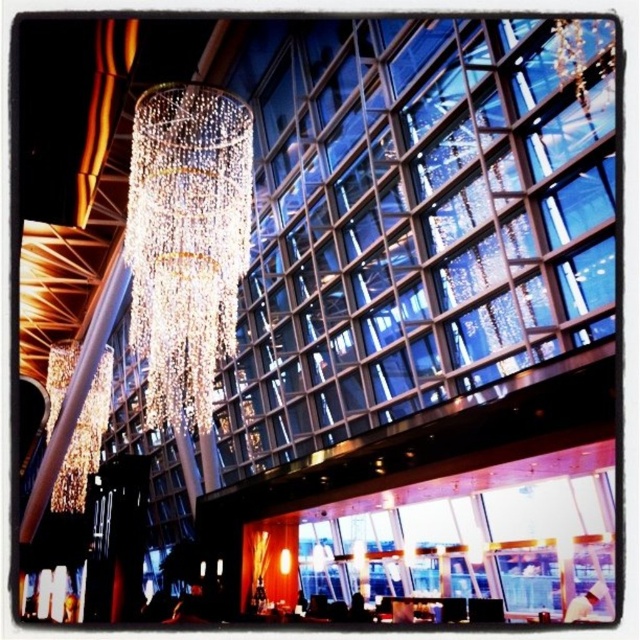
You are a guest standing in the lobby and want to locate the clear crystal chandelier at center. Which direction should you look relative to the iridescent glass chandelier at upper center?

The clear crystal chandelier at center is positioned over the iridescent glass chandelier at upper center, so you should look downward from the iridescent glass chandelier at upper center to find it.

You are standing in the lobby and want to locate both the clear crystal chandelier at center and the iridescent glass chandelier at upper center. From your vantage point, which chandelier is positioned to the right of the other?

The clear crystal chandelier at center is to the right of the iridescent glass chandelier at upper center.